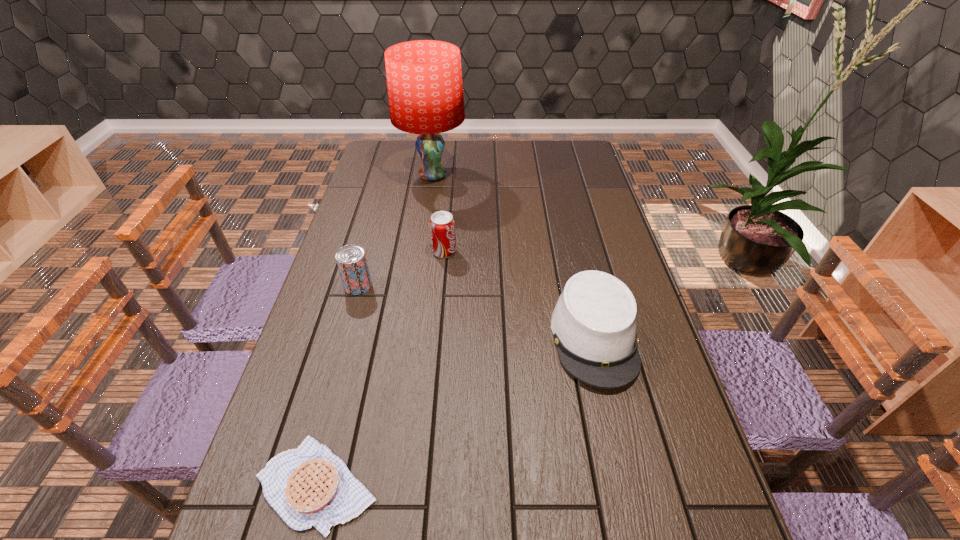
Locate an element on the screen. The image size is (960, 540). vacant space located 0.220m on the front-facing side of the rightmost object is located at coordinates pyautogui.click(x=631, y=492).

Locate an element on the screen. free space located 0.140m on the back of the pie is located at coordinates (344, 381).

You are a GUI agent. You are given a task and a screenshot of the screen. Output one action in this format:
    pyautogui.click(x=<x>, y=<y>)
    Task: Click on the object located in the far edge section of the desktop
    The width and height of the screenshot is (960, 540).
    Given the screenshot: What is the action you would take?
    pyautogui.click(x=424, y=77)

This screenshot has height=540, width=960. Find the location of `lampshade that is at the left edge`. lampshade that is at the left edge is located at coordinates (424, 77).

What are the coordinates of `beer can at the left edge` in the screenshot? It's located at 351,260.

Find the location of `pie at the left edge`. pie at the left edge is located at coordinates click(x=309, y=486).

Where is `object present at the right edge`? The height and width of the screenshot is (540, 960). object present at the right edge is located at coordinates (594, 326).

Identify the location of object located at the far left corner. This screenshot has width=960, height=540. (424, 77).

The image size is (960, 540). In the image, there is a desktop. In order to click on free region at the left edge in this screenshot , I will do `click(295, 400)`.

The height and width of the screenshot is (540, 960). What are the coordinates of `free space at the right edge of the desktop` in the screenshot? It's located at (604, 191).